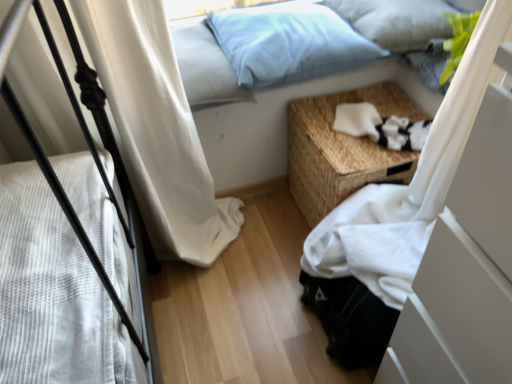
This screenshot has width=512, height=384. What are the coordinates of `light blue fabric pillow at upper center, which is the 2th pillow in left-to-right order` in the screenshot? It's located at (288, 43).

Consider the image. Measure the distance between woven wood nightstand at lower right and camera.

The distance of woven wood nightstand at lower right from camera is 1.21 meters.

Describe the element at coordinates (205, 66) in the screenshot. I see `light blue fabric pillow at upper center, marked as the third pillow in a right-to-left arrangement` at that location.

Locate an element on the screen. white fabric at lower right is located at coordinates (453, 316).

From the picture: From a real-world perspective, is white fabric at lower right over light blue fabric pillow at upper center, placed as the second pillow when sorted from right to left?

No, from a real-world perspective, white fabric at lower right is not above light blue fabric pillow at upper center, placed as the second pillow when sorted from right to left.

Considering the positions of objects white fabric at lower right and light blue fabric pillow at upper center, which is the 2th pillow in left-to-right order, in the image provided, who is more to the right, white fabric at lower right or light blue fabric pillow at upper center, which is the 2th pillow in left-to-right order,?

Positioned to the right is white fabric at lower right.

Is white fabric at lower right thinner than light blue fabric pillow at upper center, placed as the second pillow when sorted from right to left?

No.

Is light blue fabric pillow at upper center, which is the 2th pillow in left-to-right order, at the back of white fabric at lower right?

That's not correct — white fabric at lower right is not looking away from light blue fabric pillow at upper center, which is the 2th pillow in left-to-right order.

Consider the image. From the image's perspective, relative to woven wood nightstand at lower right, is light blue fabric pillow at upper center, the 1th pillow viewed from the right, above or below?

light blue fabric pillow at upper center, the 1th pillow viewed from the right, is situated higher than woven wood nightstand at lower right in the image.

Considering the positions of points (429, 17) and (294, 191), is point (429, 17) closer to camera compared to point (294, 191)?

Yes, point (429, 17) is in front of point (294, 191).

Does light blue fabric pillow at upper center, the third pillow in the left-to-right sequence, have a greater width compared to woven wood nightstand at lower right?

In fact, light blue fabric pillow at upper center, the third pillow in the left-to-right sequence, might be narrower than woven wood nightstand at lower right.

From a real-world perspective, is light blue fabric pillow at upper center, the 1th pillow viewed from the right, positioned above or below woven wood nightstand at lower right?

light blue fabric pillow at upper center, the 1th pillow viewed from the right, is above woven wood nightstand at lower right.

Starting from the light blue fabric pillow at upper center, marked as the third pillow in a right-to-left arrangement, which pillow is the 2nd one behind? Please provide its 2D coordinates.

[(396, 21)]

Is point (395, 8) closer or farther from the camera than point (182, 50)?

Point (395, 8) is positioned farther from the camera compared to point (182, 50).

Considering the positions of objects light blue fabric pillow at upper center, the 1th pillow viewed from the right, and light blue fabric pillow at upper center, which is the first pillow from left to right, in the image provided, who is more to the right, light blue fabric pillow at upper center, the 1th pillow viewed from the right, or light blue fabric pillow at upper center, which is the first pillow from left to right,?

From the viewer's perspective, light blue fabric pillow at upper center, the 1th pillow viewed from the right, appears more on the right side.

From a real-world perspective, is white soft fabric at lower right on woven wood nightstand at lower right?

Yes, from a real-world perspective, white soft fabric at lower right is over woven wood nightstand at lower right

From the image's perspective, who appears lower, white soft fabric at lower right or woven wood nightstand at lower right?

woven wood nightstand at lower right.

Is white soft fabric at lower right positioned beyond the bounds of woven wood nightstand at lower right?

No, most part of white soft fabric at lower right lies within woven wood nightstand at lower right.

Does point (416, 142) lie in front of point (315, 124)?

Yes, point (416, 142) is closer to viewer.

In the scene shown: Would you say woven wood nightstand at lower right is inside or outside light blue fabric pillow at upper center, the 1th pillow viewed from the right?

woven wood nightstand at lower right is not inside light blue fabric pillow at upper center, the 1th pillow viewed from the right, it's outside.

Would you say woven wood nightstand at lower right is to the left or to the right of light blue fabric pillow at upper center, the 1th pillow viewed from the right, in the picture?

In the image, woven wood nightstand at lower right appears on the left side of light blue fabric pillow at upper center, the 1th pillow viewed from the right.

Which object is closer to the camera taking this photo, woven wood nightstand at lower right or light blue fabric pillow at upper center, the third pillow in the left-to-right sequence?

woven wood nightstand at lower right.

Which point is more distant from viewer, (343, 178) or (446, 33)?

Positioned behind is point (446, 33).

In terms of size, does light blue fabric pillow at upper center, which is the 2th pillow in left-to-right order, appear bigger or smaller than white soft fabric at lower right?

Clearly, light blue fabric pillow at upper center, which is the 2th pillow in left-to-right order, is larger in size than white soft fabric at lower right.

Can you confirm if light blue fabric pillow at upper center, which is the 2th pillow in left-to-right order, is positioned to the right of white soft fabric at lower right?

A: In fact, light blue fabric pillow at upper center, which is the 2th pillow in left-to-right order, is to the left of white soft fabric at lower right.

From a real-world perspective, which object rests below the other?

From a 3D spatial view, white soft fabric at lower right is below.

Measure the distance between light blue fabric pillow at upper center, which is the 2th pillow in left-to-right order, and white soft fabric at lower right.

A distance of 11.10 inches exists between light blue fabric pillow at upper center, which is the 2th pillow in left-to-right order, and white soft fabric at lower right.

Considering the relative sizes of light blue fabric pillow at upper center, the 1th pillow viewed from the right, and white fabric at lower right in the image provided, is light blue fabric pillow at upper center, the 1th pillow viewed from the right, thinner than white fabric at lower right?

Yes.

Is light blue fabric pillow at upper center, the third pillow in the left-to-right sequence, placed right next to white fabric at lower right?

No, light blue fabric pillow at upper center, the third pillow in the left-to-right sequence, is not with white fabric at lower right.

Identify the location of drawer that appears below the light blue fabric pillow at upper center, the third pillow in the left-to-right sequence (from a real-world perspective). (453, 316).

Locate an element on the screen. drawer below the light blue fabric pillow at upper center, placed as the second pillow when sorted from right to left (from a real-world perspective) is located at coordinates (453, 316).

Where is `nightstand in front of the light blue fabric pillow at upper center, the third pillow in the left-to-right sequence`? nightstand in front of the light blue fabric pillow at upper center, the third pillow in the left-to-right sequence is located at coordinates (343, 149).

Based on their spatial positions, is woven wood nightstand at lower right or light blue fabric pillow at upper center, marked as the third pillow in a right-to-left arrangement, closer to light blue fabric pillow at upper center, the 1th pillow viewed from the right?

The object closer to light blue fabric pillow at upper center, the 1th pillow viewed from the right, is woven wood nightstand at lower right.

From the picture: Which object lies further to the anchor point light blue fabric pillow at upper center, which is the first pillow from left to right, white fabric at lower right or white soft fabric at lower right?

white fabric at lower right.

Based on their spatial positions, is woven wood nightstand at lower right or light blue fabric pillow at upper center, which is the 2th pillow in left-to-right order, further from white fabric at lower right?

Among the two, light blue fabric pillow at upper center, which is the 2th pillow in left-to-right order, is located further to white fabric at lower right.

Consider the image. Looking at the image, which one is located further to light blue fabric pillow at upper center, which is the first pillow from left to right, light blue fabric pillow at upper center, which is the 2th pillow in left-to-right order, or white soft fabric at lower right?

Based on the image, white soft fabric at lower right appears to be further to light blue fabric pillow at upper center, which is the first pillow from left to right.

Looking at the image, which one is located further to light blue fabric pillow at upper center, the third pillow in the left-to-right sequence, light blue fabric pillow at upper center, marked as the third pillow in a right-to-left arrangement, or white fabric at lower right?

white fabric at lower right.

From the image, which object appears to be nearer to woven wood nightstand at lower right, white soft fabric at lower right or light blue fabric pillow at upper center, which is the 2th pillow in left-to-right order?

white soft fabric at lower right is closer to woven wood nightstand at lower right.

From the image, which object appears to be nearer to white soft fabric at lower right, light blue fabric pillow at upper center, placed as the second pillow when sorted from right to left, or light blue fabric pillow at upper center, which is the first pillow from left to right?

The object closer to white soft fabric at lower right is light blue fabric pillow at upper center, placed as the second pillow when sorted from right to left.

Looking at the image, which one is located closer to woven wood nightstand at lower right, white fabric at lower right or light blue fabric pillow at upper center, placed as the second pillow when sorted from right to left?

light blue fabric pillow at upper center, placed as the second pillow when sorted from right to left, lies closer to woven wood nightstand at lower right than the other object.

Locate an element on the screen. pillow situated between light blue fabric pillow at upper center, marked as the third pillow in a right-to-left arrangement, and white soft fabric at lower right from left to right is located at coordinates (288, 43).

Locate an element on the screen. This screenshot has width=512, height=384. cat that lies between light blue fabric pillow at upper center, placed as the second pillow when sorted from right to left, and white fabric at lower right from top to bottom is located at coordinates (381, 127).

Locate an element on the screen. The width and height of the screenshot is (512, 384). pillow located between light blue fabric pillow at upper center, marked as the third pillow in a right-to-left arrangement, and woven wood nightstand at lower right in the left-right direction is located at coordinates (288, 43).

At what (x,y) coordinates should I click in order to perform the action: click on cat between light blue fabric pillow at upper center, which is the 2th pillow in left-to-right order, and woven wood nightstand at lower right in the up-down direction. Please return your answer as a coordinate pair (x, y). Image resolution: width=512 pixels, height=384 pixels. Looking at the image, I should click on point(381,127).